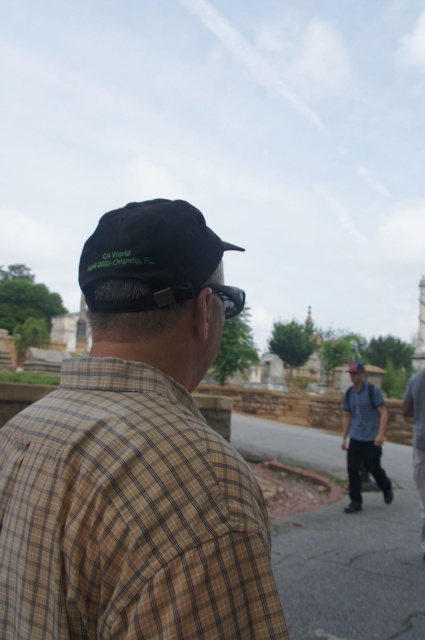
Who is positioned more to the right, brown checkered shirt at center or blue denim jeans at center?

Positioned to the right is blue denim jeans at center.

Is brown checkered shirt at center above blue denim jeans at center?

Yes, brown checkered shirt at center is above blue denim jeans at center.

What do you see at coordinates (136, 460) in the screenshot? The image size is (425, 640). I see `brown checkered shirt at center` at bounding box center [136, 460].

The image size is (425, 640). I want to click on brown checkered shirt at center, so click(136, 460).

Which is behind, point (226, 246) or point (413, 458)?

The point (413, 458) is more distant.

I want to click on black fabric baseball cap at upper left, so click(150, 256).

In order to click on black fabric baseball cap at upper left in this screenshot , I will do `click(150, 256)`.

Is denim pants at right shorter than matte black cap at center?

In fact, denim pants at right may be taller than matte black cap at center.

Is denim pants at right positioned behind matte black cap at center?

No, it is not.

The width and height of the screenshot is (425, 640). In order to click on denim pants at right in this screenshot , I will do `click(416, 436)`.